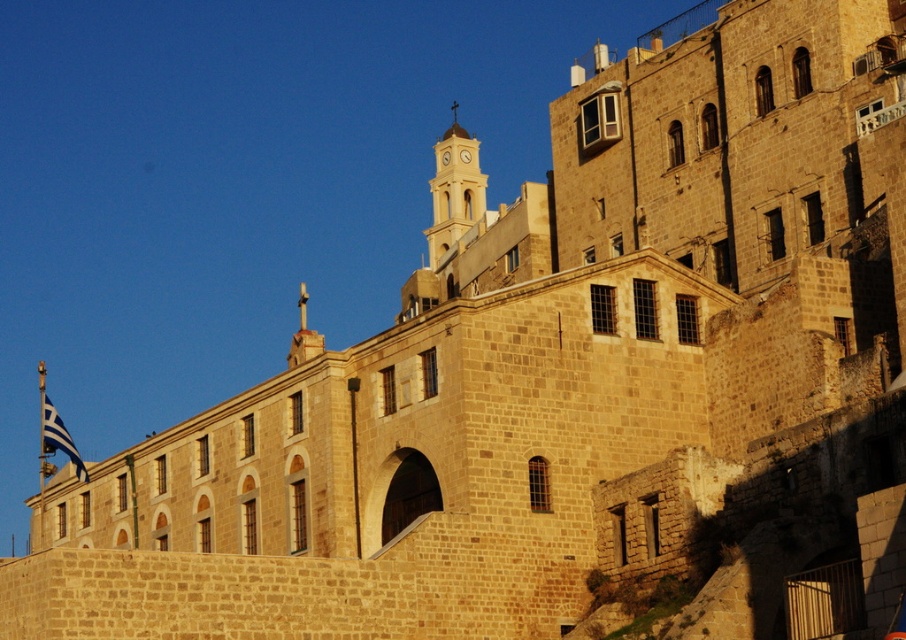
Is point (448, 168) less distant than point (467, 161)?

Yes, point (448, 168) is closer to viewer.

Is point (455, 225) positioned in front of point (467, 161)?

Yes, it is in front of point (467, 161).

This screenshot has height=640, width=906. Find the location of `light brown stone clock tower at upper center`. light brown stone clock tower at upper center is located at coordinates 454,192.

Can you confirm if light brown stone clock tower at upper center is positioned to the right of yellow metallic clock at upper center?

Indeed, light brown stone clock tower at upper center is positioned on the right side of yellow metallic clock at upper center.

Identify the location of light brown stone clock tower at upper center. (454, 192).

Measure the distance between light brown stone clock tower at upper center and camera.

The distance of light brown stone clock tower at upper center from camera is 418.80 feet.

Who is positioned more to the right, light brown stone clock tower at upper center or blue fabric flag at left?

light brown stone clock tower at upper center is more to the right.

Find the location of a particular element. The width and height of the screenshot is (906, 640). light brown stone clock tower at upper center is located at coordinates (454, 192).